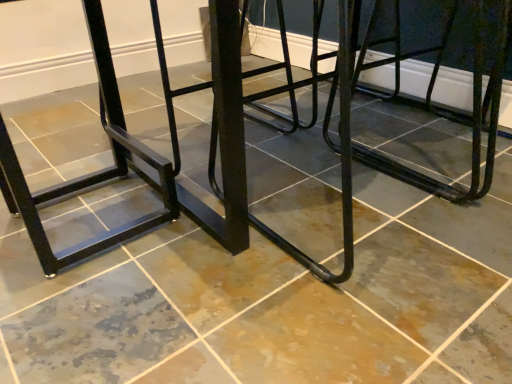
The image size is (512, 384). What are the coordinates of `vacant area that is situated to the right of black matte metal bar stool at left` in the screenshot? It's located at (202, 251).